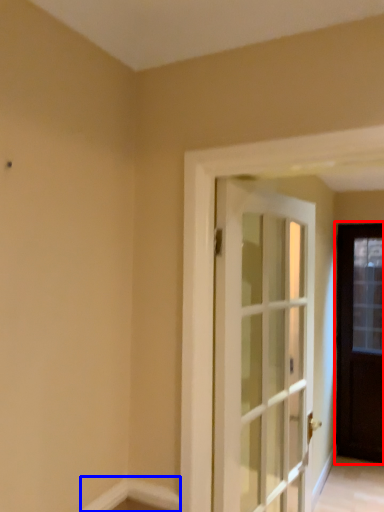
Question: Which of the following is the farthest to the observer, door (highlighted by a red box) or molding (highlighted by a blue box)?

Choices:
 (A) door
 (B) molding

Answer: (A)